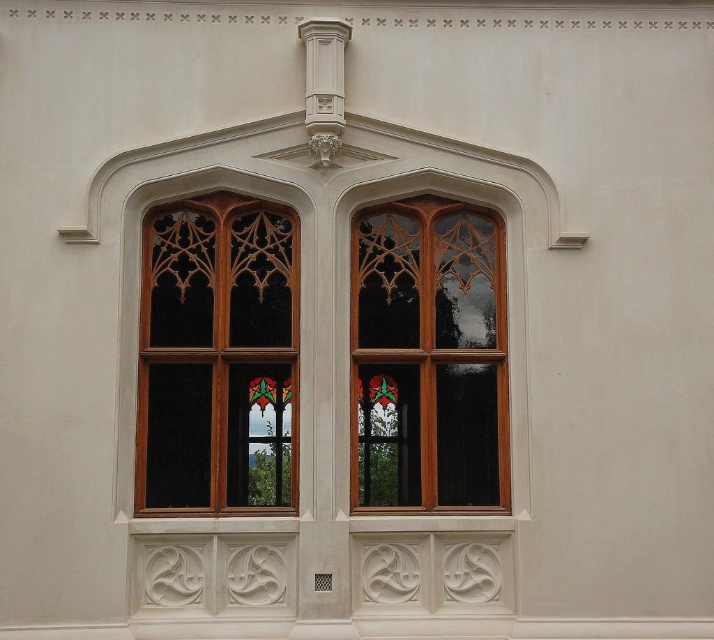
Question: Which point is farther to the camera?

Choices:
 (A) stained glass window at center
 (B) clear stained glass at left

Answer: (A)

Question: Is clear stained glass at left wider than stained glass window at center?

Choices:
 (A) yes
 (B) no

Answer: (A)

Question: Where is clear stained glass at left located in relation to stained glass window at center in the image?

Choices:
 (A) left
 (B) right

Answer: (A)

Question: Where is clear stained glass at left located in relation to stained glass window at center in the image?

Choices:
 (A) left
 (B) right

Answer: (A)

Question: Which of the following is the farthest from the observer?

Choices:
 (A) clear stained glass at left
 (B) stained glass window at center

Answer: (B)